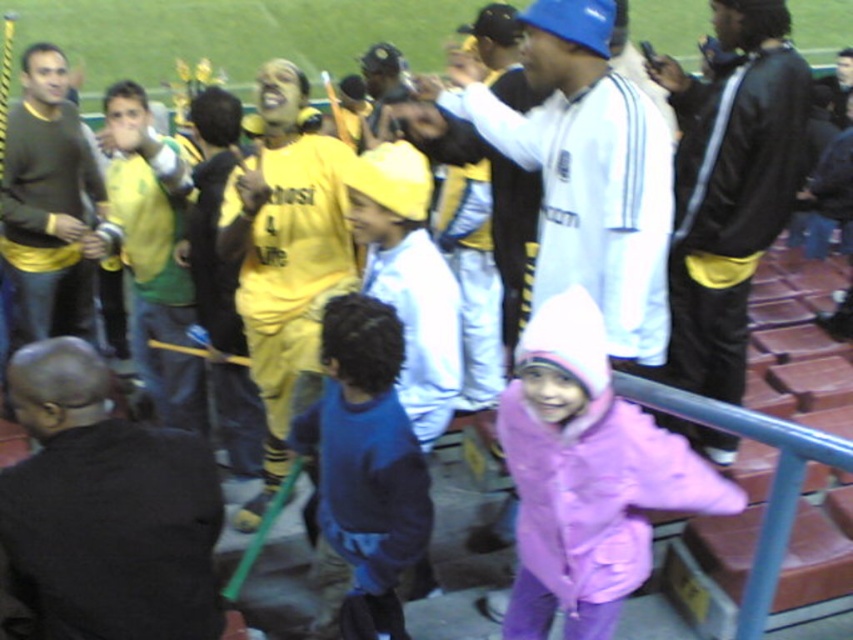
Question: Observing the image, what is the correct spatial positioning of black leather jacket at right in reference to matte green jersey at center?

Choices:
 (A) above
 (B) below

Answer: (A)

Question: Is black leather jacket at right positioned behind yellow jersey at center?

Choices:
 (A) yes
 (B) no

Answer: (B)

Question: Which point appears farthest from the camera in this image?

Choices:
 (A) (57, 248)
 (B) (581, 572)

Answer: (A)

Question: Which point is farther to the camera?

Choices:
 (A) yellow jersey at center
 (B) purple fleece jacket at lower right
 (C) black leather jacket at right

Answer: (A)

Question: Among these points, which one is farthest from the camera?

Choices:
 (A) (16, 250)
 (B) (277, 456)
 (C) (120, 172)
 (D) (366, 285)

Answer: (A)

Question: Is yellow jersey at center further to camera compared to matte yellow sweater at left?

Choices:
 (A) no
 (B) yes

Answer: (A)